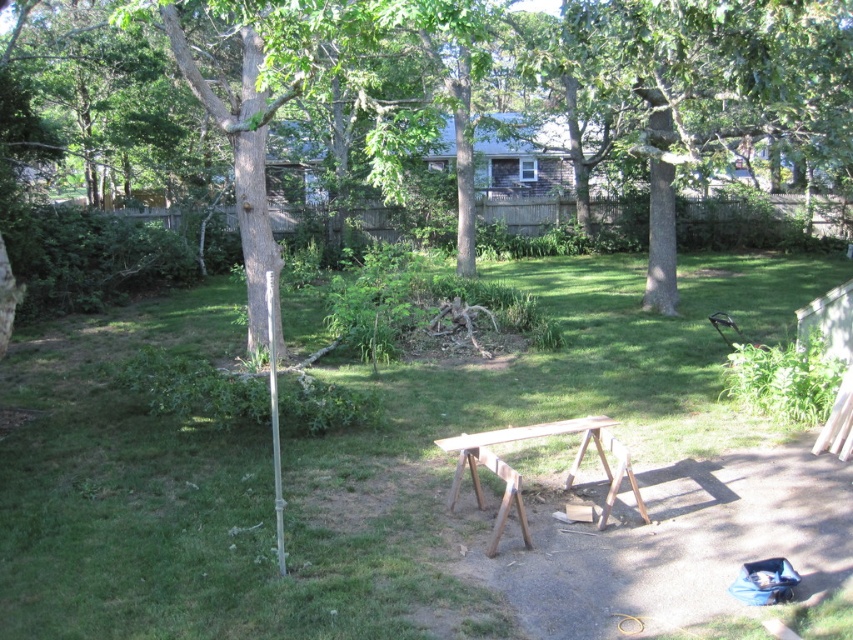
Question: Among these objects, which one is nearest to the camera?

Choices:
 (A) silver metallic pole at left
 (B) green grass at center
 (C) wooden sawhorse at center

Answer: (B)

Question: Does wooden sawhorse at center have a greater width compared to silver metallic pole at left?

Choices:
 (A) no
 (B) yes

Answer: (A)

Question: Which point appears closest to the camera in this image?

Choices:
 (A) (277, 445)
 (B) (610, 497)

Answer: (A)

Question: Among these objects, which one is farthest from the camera?

Choices:
 (A) silver metallic pole at left
 (B) green grass at center
 (C) wooden sawhorse at center

Answer: (C)

Question: Is green grass at center positioned at the back of wooden sawhorse at center?

Choices:
 (A) yes
 (B) no

Answer: (B)

Question: Is wooden sawhorse at center further to the viewer compared to silver metallic pole at left?

Choices:
 (A) no
 (B) yes

Answer: (B)